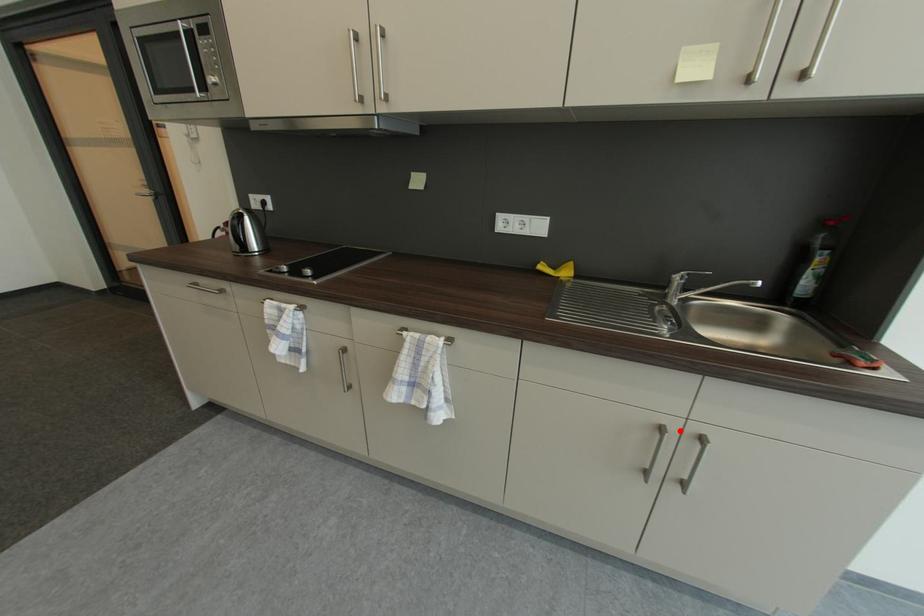
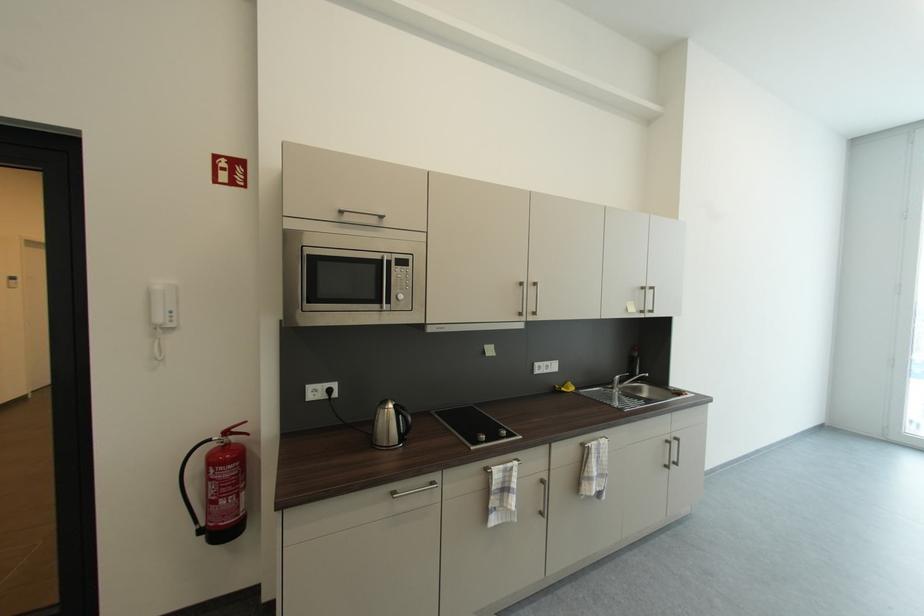
Locate, in the second image, the point that corresponds to the highlighted location in the first image.

(675, 440)